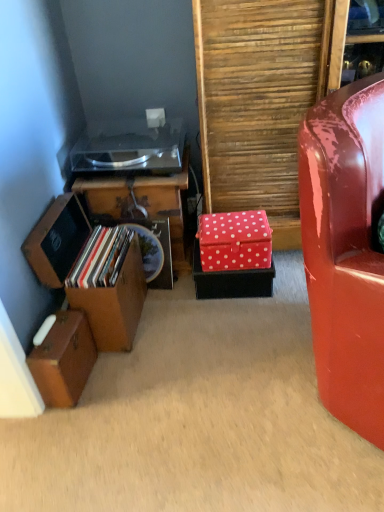
Question: In which direction should I rotate to look at red polka dot fabric box at center, which ranks as the 1th storage box in right-to-left order?

Choices:
 (A) right
 (B) left

Answer: (A)

Question: Considering the relative positions of wooden storage box at left, the second storage box in the left-to-right sequence, and wooden suitcase at lower left, placed as the third storage box when sorted from right to left, in the image provided, is wooden storage box at left, the second storage box in the left-to-right sequence, to the left of wooden suitcase at lower left, placed as the third storage box when sorted from right to left, from the viewer's perspective?

Choices:
 (A) yes
 (B) no

Answer: (B)

Question: Is wooden storage box at left, the second storage box in the left-to-right sequence, taller than wooden suitcase at lower left, placed as the third storage box when sorted from right to left?

Choices:
 (A) no
 (B) yes

Answer: (B)

Question: Can you confirm if wooden storage box at left, the second storage box in the left-to-right sequence, is bigger than wooden suitcase at lower left, marked as the first storage box in a left-to-right arrangement?

Choices:
 (A) no
 (B) yes

Answer: (B)

Question: Is wooden storage box at left, the second storage box in the left-to-right sequence, touching wooden suitcase at lower left, placed as the third storage box when sorted from right to left?

Choices:
 (A) yes
 (B) no

Answer: (B)

Question: Is wooden storage box at left, positioned as the second storage box in right-to-left order, positioned before wooden suitcase at lower left, marked as the first storage box in a left-to-right arrangement?

Choices:
 (A) no
 (B) yes

Answer: (A)

Question: From a real-world perspective, is wooden storage box at left, positioned as the second storage box in right-to-left order, on top of wooden suitcase at lower left, placed as the third storage box when sorted from right to left?

Choices:
 (A) yes
 (B) no

Answer: (A)

Question: Is there a large distance between wooden suitcase at lower left, marked as the first storage box in a left-to-right arrangement, and red polka dot box at center right?

Choices:
 (A) no
 (B) yes

Answer: (A)

Question: Is wooden suitcase at lower left, placed as the third storage box when sorted from right to left, looking in the opposite direction of red polka dot box at center right?

Choices:
 (A) no
 (B) yes

Answer: (A)

Question: Is the depth of wooden suitcase at lower left, placed as the third storage box when sorted from right to left, greater than that of red polka dot box at center right?

Choices:
 (A) yes
 (B) no

Answer: (B)

Question: From a real-world perspective, is wooden suitcase at lower left, placed as the third storage box when sorted from right to left, on red polka dot box at center right?

Choices:
 (A) yes
 (B) no

Answer: (B)

Question: Can you see wooden suitcase at lower left, marked as the first storage box in a left-to-right arrangement, touching red polka dot box at center right?

Choices:
 (A) yes
 (B) no

Answer: (B)

Question: Is wooden suitcase at lower left, marked as the first storage box in a left-to-right arrangement, shorter than red polka dot box at center right?

Choices:
 (A) no
 (B) yes

Answer: (B)

Question: Is wooden suitcase at lower left, placed as the third storage box when sorted from right to left, with wooden storage box at left, positioned as the second storage box in right-to-left order?

Choices:
 (A) yes
 (B) no

Answer: (B)